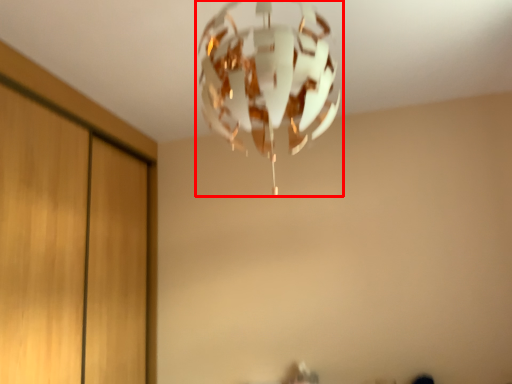
Question: In this image, where is lamp (annotated by the red box) located relative to dresser?

Choices:
 (A) left
 (B) right

Answer: (B)